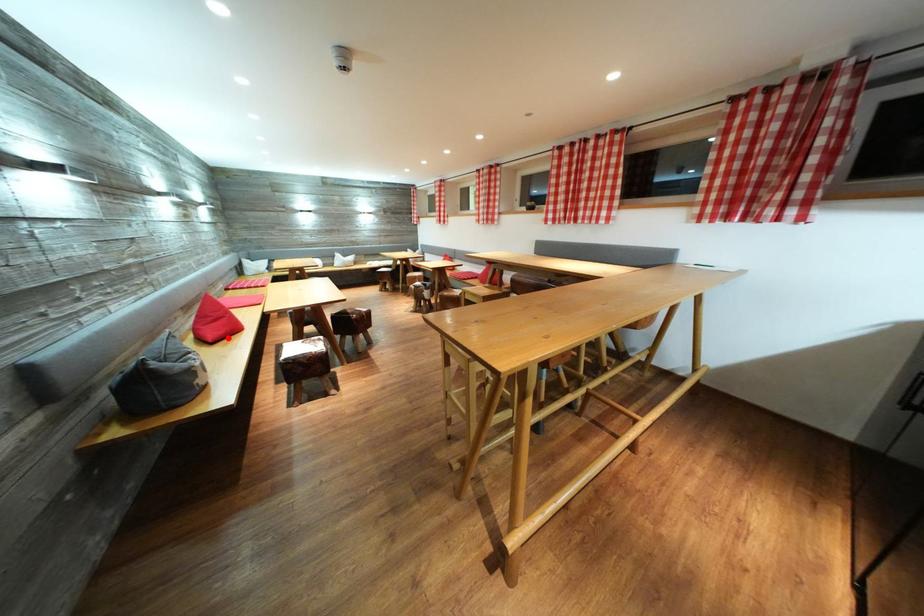
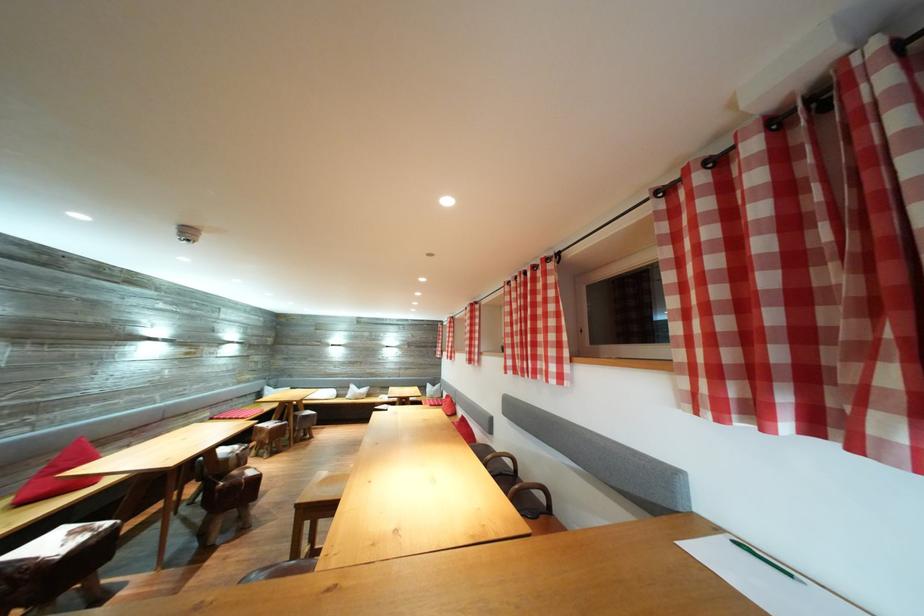
The point at the highlighted location is marked in the first image. Where is the corresponding point in the second image?

(51, 496)